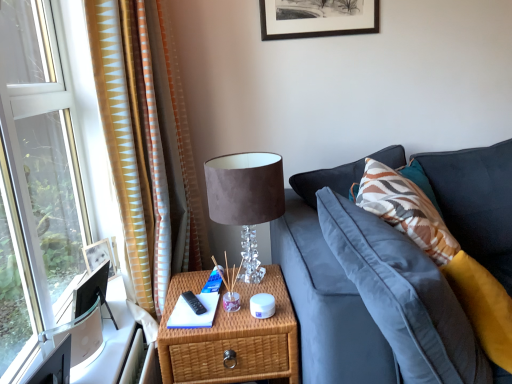
I want to click on woven wood nightstand at center, so click(231, 337).

This screenshot has height=384, width=512. I want to click on gold-patterned fabric curtain at left, so click(147, 143).

The height and width of the screenshot is (384, 512). In order to click on woven wood nightstand at center in this screenshot , I will do `click(231, 337)`.

Is velvet lampshade at upper center positioned with its back to gold-patterned fabric curtain at left?

No, velvet lampshade at upper center is not facing the opposite direction of gold-patterned fabric curtain at left.

Can we say velvet lampshade at upper center lies outside gold-patterned fabric curtain at left?

velvet lampshade at upper center lies outside gold-patterned fabric curtain at left's area.

The height and width of the screenshot is (384, 512). What are the coordinates of `curtain on the left side of velvet lampshade at upper center` in the screenshot? It's located at click(147, 143).

In the scene shown: Can you confirm if velvet lampshade at upper center is taller than gold-patterned fabric curtain at left?

Incorrect, the height of velvet lampshade at upper center is not larger of that of gold-patterned fabric curtain at left.

Who is taller, gold-patterned fabric curtain at left or velvet lampshade at upper center?

With more height is gold-patterned fabric curtain at left.

Based on their positions, is gold-patterned fabric curtain at left located to the left or right of velvet lampshade at upper center?

gold-patterned fabric curtain at left is to the left of velvet lampshade at upper center.

How different are the orientations of gold-patterned fabric curtain at left and velvet lampshade at upper center in degrees?

There is a 80.5-degree angle between the facing directions of gold-patterned fabric curtain at left and velvet lampshade at upper center.

From the image's perspective, is woven wood nightstand at center located beneath velvet lampshade at upper center?

Yes, from the image's perspective, woven wood nightstand at center is beneath velvet lampshade at upper center.

Do you think woven wood nightstand at center is within velvet lampshade at upper center, or outside of it?

woven wood nightstand at center cannot be found inside velvet lampshade at upper center.

Based on their sizes in the image, would you say woven wood nightstand at center is bigger or smaller than velvet lampshade at upper center?

Considering their sizes, woven wood nightstand at center takes up more space than velvet lampshade at upper center.

Considering the sizes of objects woven wood nightstand at center and gold-patterned fabric curtain at left in the image provided, who is wider, woven wood nightstand at center or gold-patterned fabric curtain at left?

woven wood nightstand at center.

Does woven wood nightstand at center have a smaller size compared to gold-patterned fabric curtain at left?

Correct, woven wood nightstand at center occupies less space than gold-patterned fabric curtain at left.

Is woven wood nightstand at center spatially inside gold-patterned fabric curtain at left, or outside of it?

woven wood nightstand at center is not inside gold-patterned fabric curtain at left, it's outside.

How much distance is there between woven wood nightstand at center and gold-patterned fabric curtain at left?

They are 18.07 inches apart.

Can you confirm if gold-patterned fabric curtain at left is thinner than woven wood nightstand at center?

Yes, gold-patterned fabric curtain at left is thinner than woven wood nightstand at center.

Relative to woven wood nightstand at center, is gold-patterned fabric curtain at left in front or behind?

gold-patterned fabric curtain at left is positioned farther from the viewer than woven wood nightstand at center.

Does point (127, 51) come farther from viewer compared to point (275, 327)?

Yes, point (127, 51) is behind point (275, 327).

How much distance is there between gold-patterned fabric curtain at left and woven wood nightstand at center?

gold-patterned fabric curtain at left and woven wood nightstand at center are 18.07 inches apart from each other.

Between velvet lampshade at upper center and woven wood nightstand at center, which one has larger size?

woven wood nightstand at center is bigger.

Is velvet lampshade at upper center in front of or behind woven wood nightstand at center in the image?

velvet lampshade at upper center is behind woven wood nightstand at center.

Does velvet lampshade at upper center have a lesser width compared to woven wood nightstand at center?

Yes.

From the image's perspective, is velvet lampshade at upper center on top of woven wood nightstand at center?

Yes, from the image's perspective, velvet lampshade at upper center is above woven wood nightstand at center.

The image size is (512, 384). I want to click on curtain that appears above the velvet lampshade at upper center (from a real-world perspective), so click(x=147, y=143).

The image size is (512, 384). I want to click on table lamp below the gold-patterned fabric curtain at left (from the image's perspective), so click(246, 199).

Estimate the real-world distances between objects in this image. Which object is closer to velvet lampshade at upper center, woven wood nightstand at center or gold-patterned fabric curtain at left?

The object closer to velvet lampshade at upper center is woven wood nightstand at center.

When comparing their distances from velvet lampshade at upper center, does gold-patterned fabric curtain at left or woven wood nightstand at center seem closer?

woven wood nightstand at center lies closer to velvet lampshade at upper center than the other object.

Based on their spatial positions, is velvet lampshade at upper center or gold-patterned fabric curtain at left further from woven wood nightstand at center?

The object further to woven wood nightstand at center is gold-patterned fabric curtain at left.

Which object lies further to the anchor point woven wood nightstand at center, gold-patterned fabric curtain at left or velvet lampshade at upper center?

gold-patterned fabric curtain at left is further to woven wood nightstand at center.

Estimate the real-world distances between objects in this image. Which object is closer to gold-patterned fabric curtain at left, woven wood nightstand at center or velvet lampshade at upper center?

Among the two, velvet lampshade at upper center is located nearer to gold-patterned fabric curtain at left.

From the image, which object appears to be nearer to gold-patterned fabric curtain at left, velvet lampshade at upper center or woven wood nightstand at center?

The object closer to gold-patterned fabric curtain at left is velvet lampshade at upper center.

Where is `table lamp between gold-patterned fabric curtain at left and woven wood nightstand at center in the up-down direction`? This screenshot has width=512, height=384. table lamp between gold-patterned fabric curtain at left and woven wood nightstand at center in the up-down direction is located at coordinates (246, 199).